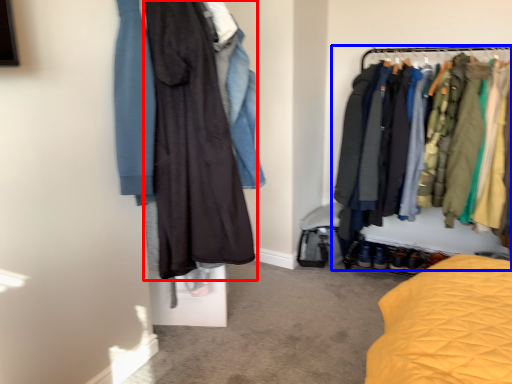
Question: Which object is further to the camera taking this photo, fancy dress (highlighted by a red box) or closet (highlighted by a blue box)?

Choices:
 (A) fancy dress
 (B) closet

Answer: (B)